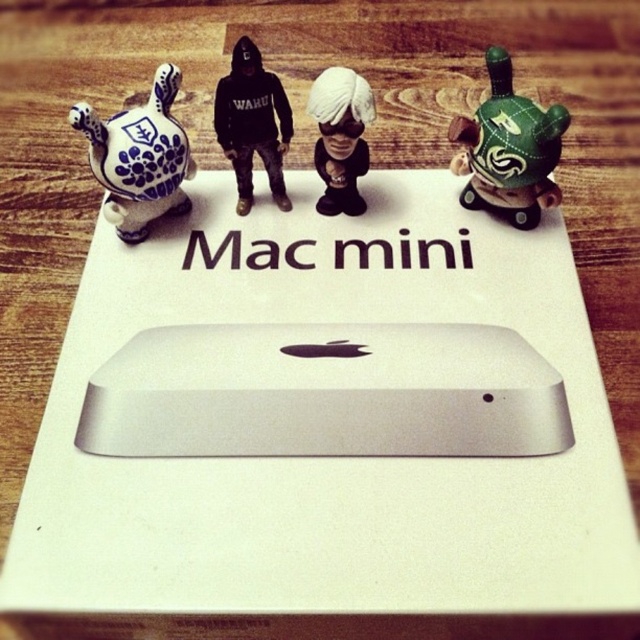
Question: Is blue and white ceramic duck at left positioned at the back of white matte figurine at center?

Choices:
 (A) yes
 (B) no

Answer: (B)

Question: Does green matte turtle at upper right appear over black hoodie at center?

Choices:
 (A) yes
 (B) no

Answer: (B)

Question: Which point is farther to the camera?

Choices:
 (A) (88, 122)
 (B) (276, 84)
 (C) (456, 138)

Answer: (C)

Question: Does silver metallic mac mini at center have a lesser width compared to black hoodie at center?

Choices:
 (A) yes
 (B) no

Answer: (B)

Question: Among these objects, which one is nearest to the camera?

Choices:
 (A) green matte turtle at upper right
 (B) black hoodie at center
 (C) blue and white ceramic duck at left

Answer: (C)

Question: Which point appears farthest from the camera in this image?

Choices:
 (A) (465, 156)
 (B) (346, 147)
 (C) (232, 56)

Answer: (A)